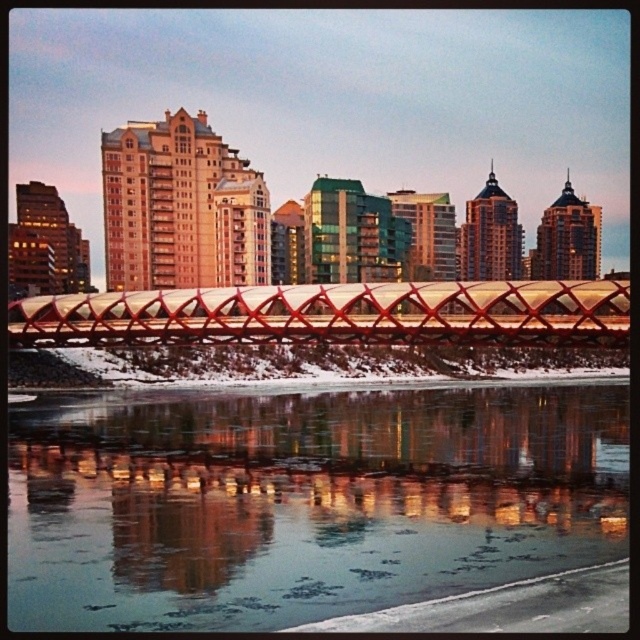
You are a photographer planning to capture the entire view of the metallic red bridge at center and the frozen glassy water at lower center in a single shot. Based on their sizes, which one will appear smaller in the photo?

The frozen glassy water at lower center will appear smaller in the photo because it has a smaller size compared to the metallic red bridge at center.

You are a city planner evaluating the safety of the metallic red bridge at center. Considering the frozen glassy water at lower center, which object is closer to the surface of the water?

The frozen glassy water at lower center is shorter than the metallic red bridge at center, so the frozen glassy water at lower center is closer to the surface of the water.